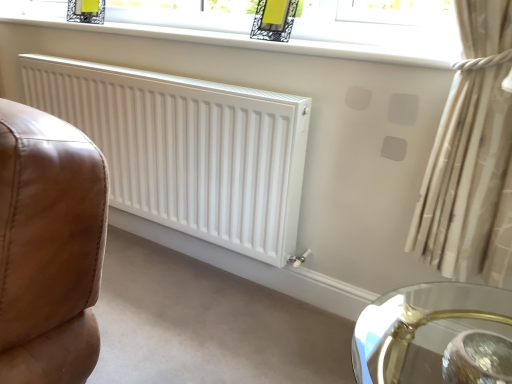
What is the approximate width of beige fabric curtain at right?

It is 8.11 inches.

Locate an element on the screen. This screenshot has width=512, height=384. clear glass window at upper center is located at coordinates (272, 42).

Looking at this image, from a real-world perspective, is clear glass window at upper center physically located above or below beige fabric curtain at right?

clear glass window at upper center is above beige fabric curtain at right.

Can we say clear glass window at upper center lies outside beige fabric curtain at right?

Yes.

Considering the points (176, 36) and (413, 240), which point is behind, point (176, 36) or point (413, 240)?

Positioned behind is point (176, 36).

Considering the sizes of objects white matte radiator at center and clear glass window at upper center in the image provided, who is wider, white matte radiator at center or clear glass window at upper center?

clear glass window at upper center.

Is white matte radiator at center surrounding clear glass window at upper center?

No, clear glass window at upper center is not inside white matte radiator at center.

Are white matte radiator at center and clear glass window at upper center making contact?

No, white matte radiator at center is not beside clear glass window at upper center.

Based on their sizes in the image, would you say white matte radiator at center is bigger or smaller than beige fabric curtain at right?

Clearly, white matte radiator at center is larger in size than beige fabric curtain at right.

Are white matte radiator at center and beige fabric curtain at right making contact?

No, white matte radiator at center is not in contact with beige fabric curtain at right.

From a real-world perspective, which object stands above the other?

beige fabric curtain at right.

Is white matte radiator at center wider or thinner than beige fabric curtain at right?

white matte radiator at center is thinner than beige fabric curtain at right.

At what (x,y) coordinates should I click in order to perform the action: click on window in front of the white matte radiator at center. Please return your answer as a coordinate pair (x, y). Looking at the image, I should click on (272, 42).

Is clear glass window at upper center bigger than white matte radiator at center?

Actually, clear glass window at upper center might be smaller than white matte radiator at center.

Is clear glass window at upper center to the right of white matte radiator at center from the viewer's perspective?

Yes.

Can you tell me how much beige fabric curtain at right and clear glass window at upper center differ in facing direction?

They differ by 90.5 degrees in their facing directions.

In terms of height, does beige fabric curtain at right look taller or shorter compared to clear glass window at upper center?

Clearly, beige fabric curtain at right is taller compared to clear glass window at upper center.

Between point (468, 174) and point (242, 7), which one is positioned in front?

Point (468, 174)

What are the coordinates of `window behind the beige fabric curtain at right` in the screenshot? It's located at (272, 42).

Is point (493, 153) behind point (34, 88)?

No.

Is beige fabric curtain at right taller than white matte radiator at center?

No, beige fabric curtain at right is not taller than white matte radiator at center.

Is beige fabric curtain at right aimed at white matte radiator at center?

Yes, beige fabric curtain at right faces towards white matte radiator at center.

Considering the sizes of objects beige fabric curtain at right and white matte radiator at center in the image provided, who is bigger, beige fabric curtain at right or white matte radiator at center?

white matte radiator at center.

Find the location of `curtain to the right of clear glass window at upper center`. curtain to the right of clear glass window at upper center is located at coordinates (472, 156).

Where is `radiator located below the clear glass window at upper center (from the image's perspective)`? The height and width of the screenshot is (384, 512). radiator located below the clear glass window at upper center (from the image's perspective) is located at coordinates (187, 149).

Considering their positions, is clear glass window at upper center positioned closer to beige fabric curtain at right than white matte radiator at center?

Among the two, clear glass window at upper center is located nearer to beige fabric curtain at right.

Estimate the real-world distances between objects in this image. Which object is further from clear glass window at upper center, white matte radiator at center or beige fabric curtain at right?

The object further to clear glass window at upper center is beige fabric curtain at right.

From the image, which object appears to be nearer to clear glass window at upper center, beige fabric curtain at right or white matte radiator at center?

The object closer to clear glass window at upper center is white matte radiator at center.

When comparing their distances from beige fabric curtain at right, does white matte radiator at center or clear glass window at upper center seem closer?

clear glass window at upper center is positioned closer to the anchor beige fabric curtain at right.

When comparing their distances from white matte radiator at center, does beige fabric curtain at right or clear glass window at upper center seem further?

beige fabric curtain at right is positioned further to the anchor white matte radiator at center.

Based on their spatial positions, is clear glass window at upper center or beige fabric curtain at right closer to white matte radiator at center?

Among the two, clear glass window at upper center is located nearer to white matte radiator at center.

This screenshot has width=512, height=384. In order to click on window between beige fabric curtain at right and white matte radiator at center from front to back in this screenshot , I will do `click(272, 42)`.